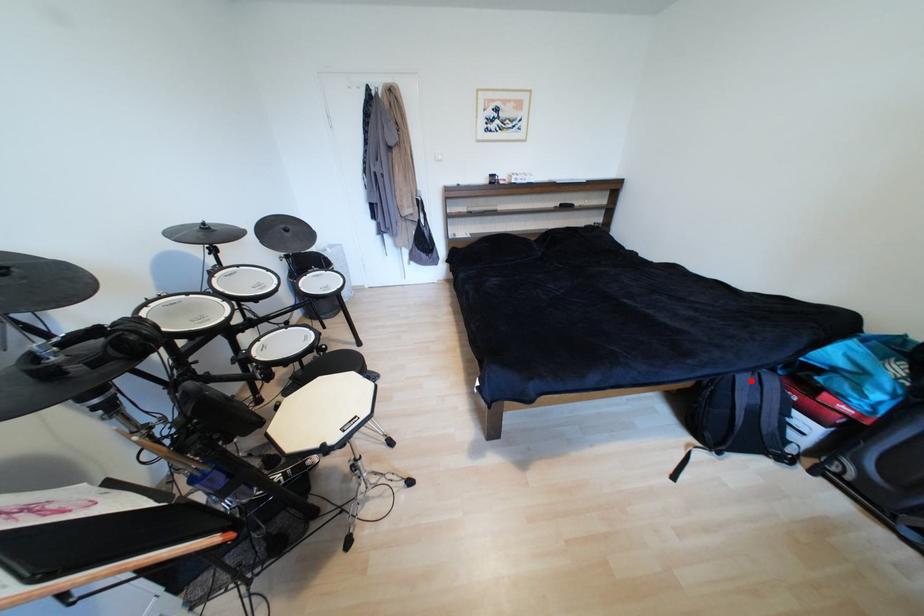
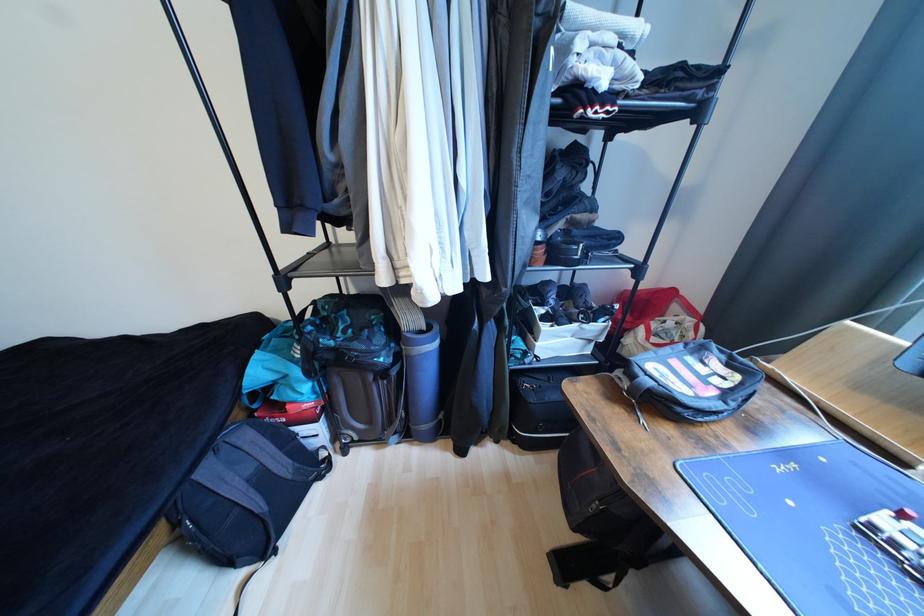
Locate, in the second image, the point that corresponds to the highlighted location in the first image.

(215, 472)